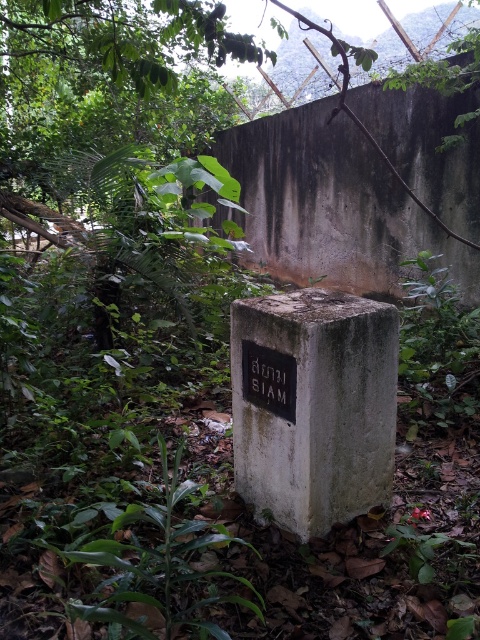
You are a hiker who has stumbled upon this overgrown area with a weathered concrete block. You notice two points marked on a map at coordinates point (339,385) and point (289,408). According to the map, which point is closer to you when you are standing directly in front of the concrete block?

Point (339,385) is in front of point (289,408), so it is closer to you when standing directly in front of the concrete block.

You are a landscape architect designing a garden path around the gray concrete block at center and the black matte plaque at center. Which object requires a wider pathway to accommodate its base?

The gray concrete block at center requires a wider pathway since its width surpasses that of the black matte plaque at center.